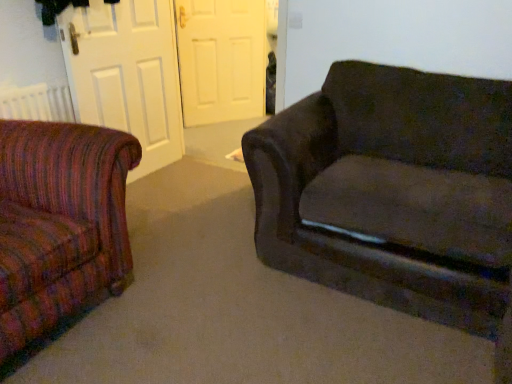
Question: Is white matte door at center, placed as the 1th screen door when sorted from back to front, oriented away from dark fabric couch at right?

Choices:
 (A) yes
 (B) no

Answer: (B)

Question: Is the position of white matte door at center, which appears as the second screen door when viewed from the front, more distant than that of dark fabric couch at right?

Choices:
 (A) yes
 (B) no

Answer: (A)

Question: Can you confirm if white matte door at center, which appears as the second screen door when viewed from the front, is positioned to the right of dark fabric couch at right?

Choices:
 (A) yes
 (B) no

Answer: (B)

Question: Is white matte door at center, placed as the 1th screen door when sorted from back to front, located outside dark fabric couch at right?

Choices:
 (A) no
 (B) yes

Answer: (B)

Question: From the image's perspective, is white matte door at center, placed as the 1th screen door when sorted from back to front, beneath dark fabric couch at right?

Choices:
 (A) no
 (B) yes

Answer: (A)

Question: In terms of width, does matte white door at left, which is the second screen door from back to front, look wider or thinner when compared to white matte door at center, which appears as the second screen door when viewed from the front?

Choices:
 (A) thin
 (B) wide

Answer: (A)

Question: From a real-world perspective, is matte white door at left, which ranks as the 1th screen door in front-to-back order, physically located above or below white matte door at center, which appears as the second screen door when viewed from the front?

Choices:
 (A) below
 (B) above

Answer: (B)

Question: Is point (128, 46) closer or farther from the camera than point (237, 49)?

Choices:
 (A) closer
 (B) farther

Answer: (A)

Question: Based on their sizes in the image, would you say matte white door at left, which is the second screen door from back to front, is bigger or smaller than white matte door at center, which appears as the second screen door when viewed from the front?

Choices:
 (A) small
 (B) big

Answer: (B)

Question: Is point (416, 196) closer or farther from the camera than point (118, 82)?

Choices:
 (A) farther
 (B) closer

Answer: (B)

Question: Based on their positions, is dark fabric couch at right located to the left or right of matte white door at left, which is the second screen door from back to front?

Choices:
 (A) right
 (B) left

Answer: (A)

Question: From a real-world perspective, is dark fabric couch at right positioned above or below matte white door at left, which ranks as the 1th screen door in front-to-back order?

Choices:
 (A) above
 (B) below

Answer: (B)

Question: Would you say dark fabric couch at right is inside or outside matte white door at left, which is the second screen door from back to front?

Choices:
 (A) outside
 (B) inside

Answer: (A)

Question: From a real-world perspective, is white matte door at center, placed as the 1th screen door when sorted from back to front, positioned above or below dark fabric couch at right?

Choices:
 (A) below
 (B) above

Answer: (B)

Question: In terms of height, does white matte door at center, which appears as the second screen door when viewed from the front, look taller or shorter compared to dark fabric couch at right?

Choices:
 (A) tall
 (B) short

Answer: (A)